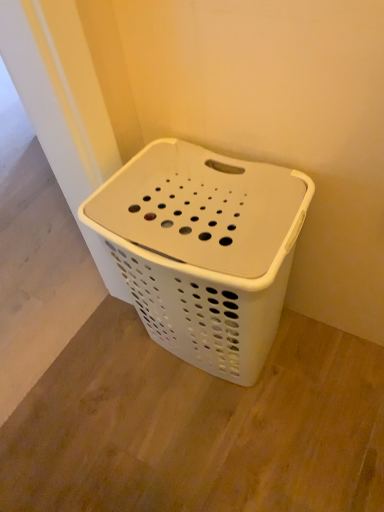
Locate an element on the screen. The height and width of the screenshot is (512, 384). free space in front of white plastic laundry basket at center is located at coordinates (239, 445).